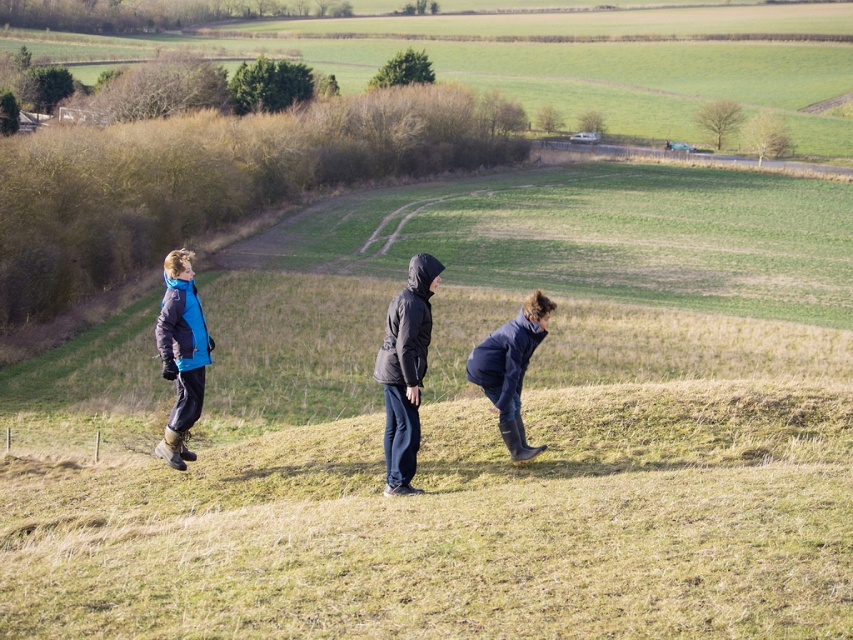
Question: Is matte blue jacket at left bigger than dark blue rubber boots at center?

Choices:
 (A) no
 (B) yes

Answer: (A)

Question: Which object is positioned farthest from the black quilted jacket at center?

Choices:
 (A) dark blue rubber boots at center
 (B) matte blue jacket at left

Answer: (B)

Question: Among these objects, which one is farthest from the camera?

Choices:
 (A) matte blue jacket at left
 (B) dark blue rubber boots at center
 (C) black quilted jacket at center

Answer: (A)

Question: Which point is farther to the camera?

Choices:
 (A) matte blue jacket at left
 (B) dark blue rubber boots at center

Answer: (A)

Question: Does matte blue jacket at left have a lesser width compared to dark blue rubber boots at center?

Choices:
 (A) no
 (B) yes

Answer: (B)

Question: Is the position of matte blue jacket at left less distant than that of dark blue rubber boots at center?

Choices:
 (A) yes
 (B) no

Answer: (B)